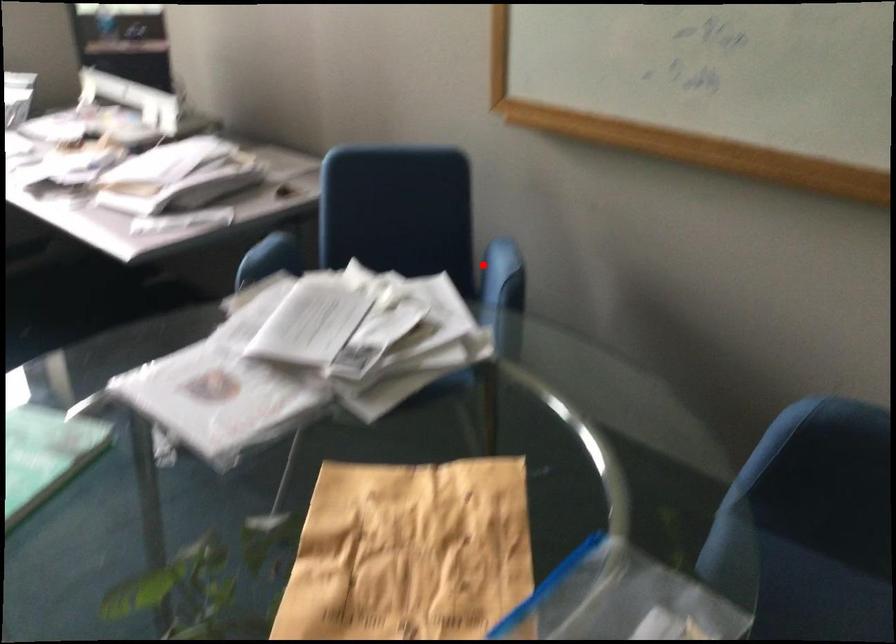
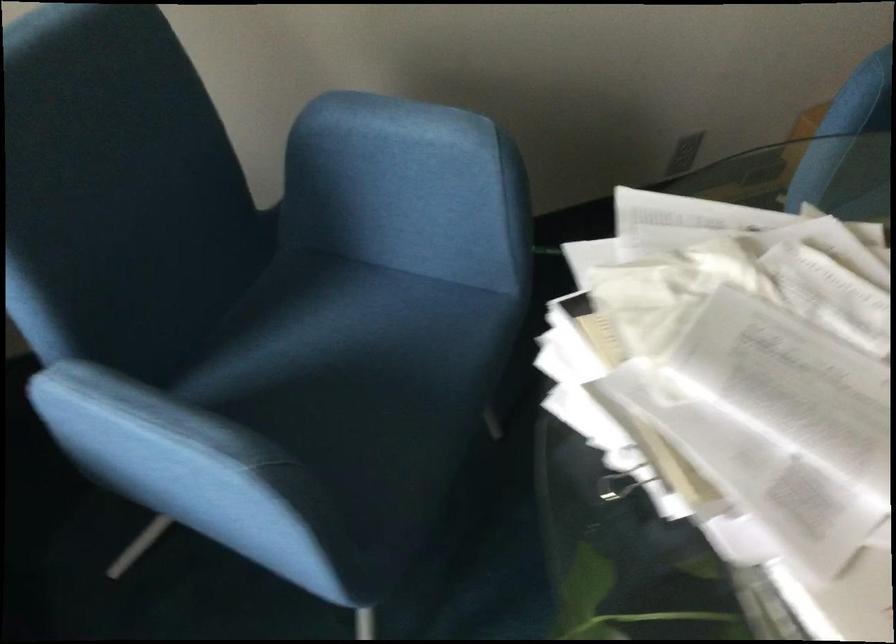
Question: A red point is marked in image1. In image2, is the corresponding 3D point closer to the camera or farther? Reply with the corresponding letter.

Choices:
 (A) The corresponding 3D point is closer.
 (B) The corresponding 3D point is farther.

Answer: (A)